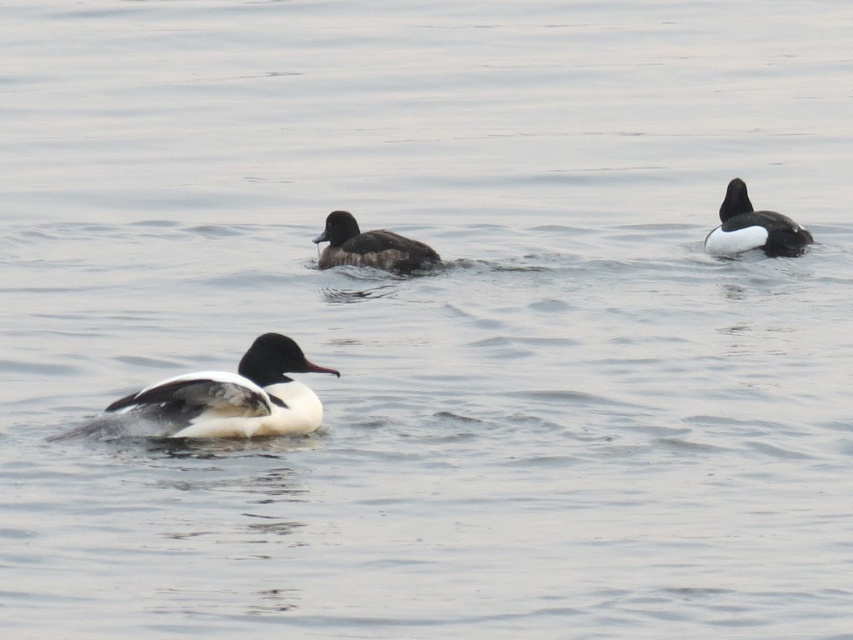
Question: Estimate the real-world distances between objects in this image. Which object is closer to the white matte duck at upper right?

Choices:
 (A) dark brown feathers at center
 (B) white matte duck at center

Answer: (A)

Question: From the image, what is the correct spatial relationship of white matte duck at upper right in relation to dark brown feathers at center?

Choices:
 (A) below
 (B) above

Answer: (B)

Question: Does white matte duck at center have a larger size compared to dark brown feathers at center?

Choices:
 (A) yes
 (B) no

Answer: (A)

Question: Does white matte duck at center appear on the left side of white matte duck at upper right?

Choices:
 (A) no
 (B) yes

Answer: (B)

Question: Which object is positioned farthest from the white matte duck at center?

Choices:
 (A) dark brown feathers at center
 (B) white matte duck at upper right

Answer: (B)

Question: Which of the following is the closest to the observer?

Choices:
 (A) (270, 337)
 (B) (729, 236)

Answer: (A)